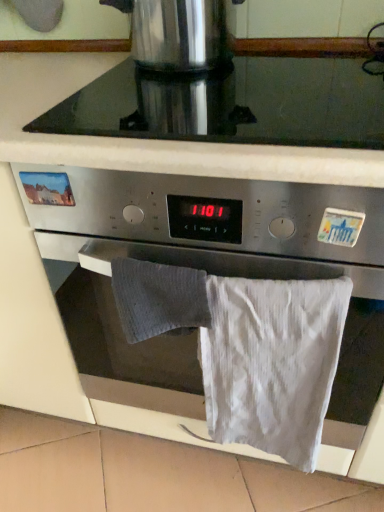
At what (x,y) coordinates should I click in order to perform the action: click on stainless steel coffee pot at upper center. Please return your answer as a coordinate pair (x, y). The width and height of the screenshot is (384, 512). Looking at the image, I should click on (179, 32).

In order to face stainless steel coffee pot at upper center, should I rotate leftwards or rightwards?

You should look left and rotate roughly 0.611 degrees.

Describe the element at coordinates (231, 104) in the screenshot. I see `black glass at upper center` at that location.

This screenshot has height=512, width=384. In order to click on stainless steel coffee pot at upper center in this screenshot , I will do `click(179, 32)`.

Can you confirm if black glass at upper center is thinner than satin silver oven at center?

Indeed, black glass at upper center has a lesser width compared to satin silver oven at center.

Can you confirm if black glass at upper center is taller than satin silver oven at center?

Incorrect, the height of black glass at upper center is not larger of that of satin silver oven at center.

Is black glass at upper center outside of satin silver oven at center?

black glass at upper center is positioned outside satin silver oven at center.

Locate an element on the screen. oven on the right of black glass at upper center is located at coordinates (191, 265).

Identify the location of gas stove on the right of stainless steel coffee pot at upper center. (231, 104).

Considering the positions of point (312, 88) and point (174, 52), is point (312, 88) closer or farther from the camera than point (174, 52)?

Point (312, 88) appears to be farther away from the viewer than point (174, 52).

From a real-world perspective, which object rests below the other?

black glass at upper center is physically lower.

Considering the relative sizes of stainless steel coffee pot at upper center and satin silver oven at center in the image provided, is stainless steel coffee pot at upper center thinner than satin silver oven at center?

Yes, stainless steel coffee pot at upper center is thinner than satin silver oven at center.

Is the surface of stainless steel coffee pot at upper center in direct contact with satin silver oven at center?

No, stainless steel coffee pot at upper center is not touching satin silver oven at center.

Does stainless steel coffee pot at upper center appear on the left side of satin silver oven at center?

Yes.

Measure the distance from stainless steel coffee pot at upper center to white cotton bath towel at lower center.

stainless steel coffee pot at upper center and white cotton bath towel at lower center are 22.75 inches apart.

Is stainless steel coffee pot at upper center next to white cotton bath towel at lower center and touching it?

No.

Is stainless steel coffee pot at upper center smaller than white cotton bath towel at lower center?

No.

Which is behind, point (154, 68) or point (337, 302)?

The point (154, 68) is farther.

Where is `bath towel in front of the stainless steel coffee pot at upper center`? The width and height of the screenshot is (384, 512). bath towel in front of the stainless steel coffee pot at upper center is located at coordinates (272, 362).

Considering the sizes of objects white cotton bath towel at lower center and stainless steel coffee pot at upper center in the image provided, who is smaller, white cotton bath towel at lower center or stainless steel coffee pot at upper center?

Smaller between the two is white cotton bath towel at lower center.

Which is less distant, (x=213, y=426) or (x=137, y=21)?

The point (x=137, y=21) is closer to the camera.

Would you consider white cotton bath towel at lower center to be distant from stainless steel coffee pot at upper center?

white cotton bath towel at lower center is actually quite close to stainless steel coffee pot at upper center.

You are a GUI agent. You are given a task and a screenshot of the screen. Output one action in this format:
    pyautogui.click(x=<x>, y=<y>)
    Task: Click on the gas stove above the satin silver oven at center (from a real-world perspective)
    
    Given the screenshot: What is the action you would take?
    [x=231, y=104]

How far apart are satin silver oven at center and black glass at upper center?

satin silver oven at center is 12.51 inches away from black glass at upper center.

In the scene shown: Is satin silver oven at center bigger or smaller than black glass at upper center?

In the image, satin silver oven at center appears to be larger than black glass at upper center.

Would you say satin silver oven at center is inside or outside black glass at upper center?

satin silver oven at center is not inside black glass at upper center, it's outside.

How distant is satin silver oven at center from stainless steel coffee pot at upper center?

satin silver oven at center is 20.31 inches from stainless steel coffee pot at upper center.

Considering the sizes of satin silver oven at center and stainless steel coffee pot at upper center in the image, is satin silver oven at center wider or thinner than stainless steel coffee pot at upper center?

Clearly, satin silver oven at center has more width compared to stainless steel coffee pot at upper center.

From the image's perspective, is satin silver oven at center above stainless steel coffee pot at upper center?

No, from the image's perspective, satin silver oven at center is not above stainless steel coffee pot at upper center.

Based on the photo, which object is closer to the camera, satin silver oven at center or stainless steel coffee pot at upper center?

satin silver oven at center is closer to the camera.

Where is `oven that appears below the black glass at upper center (from a real-world perspective)`? This screenshot has width=384, height=512. oven that appears below the black glass at upper center (from a real-world perspective) is located at coordinates (191, 265).

Identify the location of kitchen appliance behind the black glass at upper center. (179, 32).

Based on their spatial positions, is black glass at upper center or stainless steel coffee pot at upper center closer to white cotton bath towel at lower center?

black glass at upper center is closer to white cotton bath towel at lower center.

From the picture: Estimate the real-world distances between objects in this image. Which object is further from black glass at upper center, stainless steel coffee pot at upper center or white cotton bath towel at lower center?

Among the two, white cotton bath towel at lower center is located further to black glass at upper center.

Estimate the real-world distances between objects in this image. Which object is further from black glass at upper center, satin silver oven at center or white cotton bath towel at lower center?

Among the two, white cotton bath towel at lower center is located further to black glass at upper center.

From the image, which object appears to be farther from stainless steel coffee pot at upper center, black glass at upper center or white cotton bath towel at lower center?

white cotton bath towel at lower center is positioned further to the anchor stainless steel coffee pot at upper center.

Which object lies nearer to the anchor point white cotton bath towel at lower center, stainless steel coffee pot at upper center or satin silver oven at center?

satin silver oven at center is positioned closer to the anchor white cotton bath towel at lower center.

Based on their spatial positions, is white cotton bath towel at lower center or black glass at upper center closer to stainless steel coffee pot at upper center?

Based on the image, black glass at upper center appears to be nearer to stainless steel coffee pot at upper center.

Considering their positions, is black glass at upper center positioned closer to white cotton bath towel at lower center than satin silver oven at center?

satin silver oven at center.

Estimate the real-world distances between objects in this image. Which object is closer to satin silver oven at center, stainless steel coffee pot at upper center or black glass at upper center?

black glass at upper center is positioned closer to the anchor satin silver oven at center.

The image size is (384, 512). Identify the location of gas stove that lies between stainless steel coffee pot at upper center and white cotton bath towel at lower center from top to bottom. (231, 104).

Locate an element on the screen. The image size is (384, 512). oven that lies between black glass at upper center and white cotton bath towel at lower center from top to bottom is located at coordinates [191, 265].

Find the location of a particular element. This screenshot has height=512, width=384. oven between stainless steel coffee pot at upper center and white cotton bath towel at lower center in the up-down direction is located at coordinates pyautogui.click(x=191, y=265).

Image resolution: width=384 pixels, height=512 pixels. Identify the location of gas stove that lies between stainless steel coffee pot at upper center and satin silver oven at center from top to bottom. (231, 104).